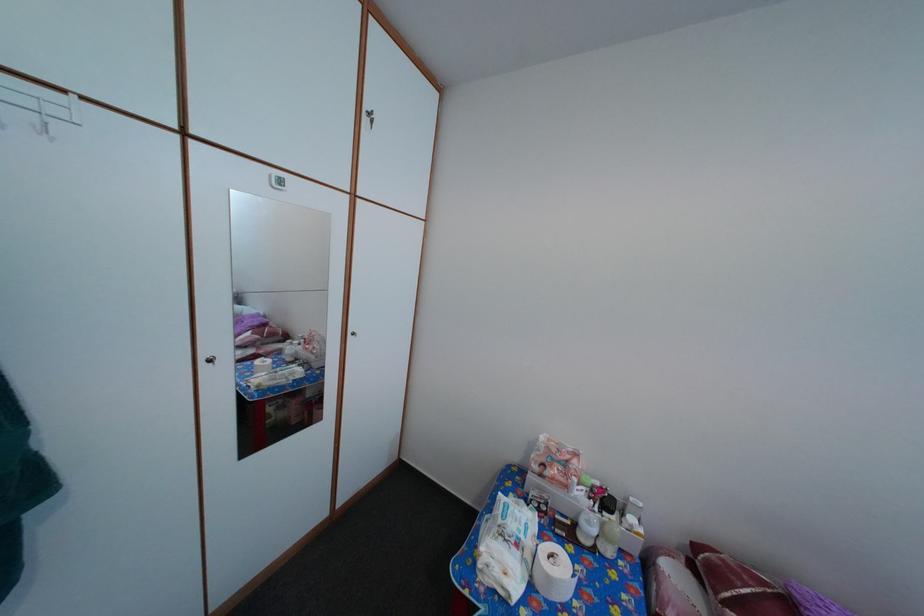
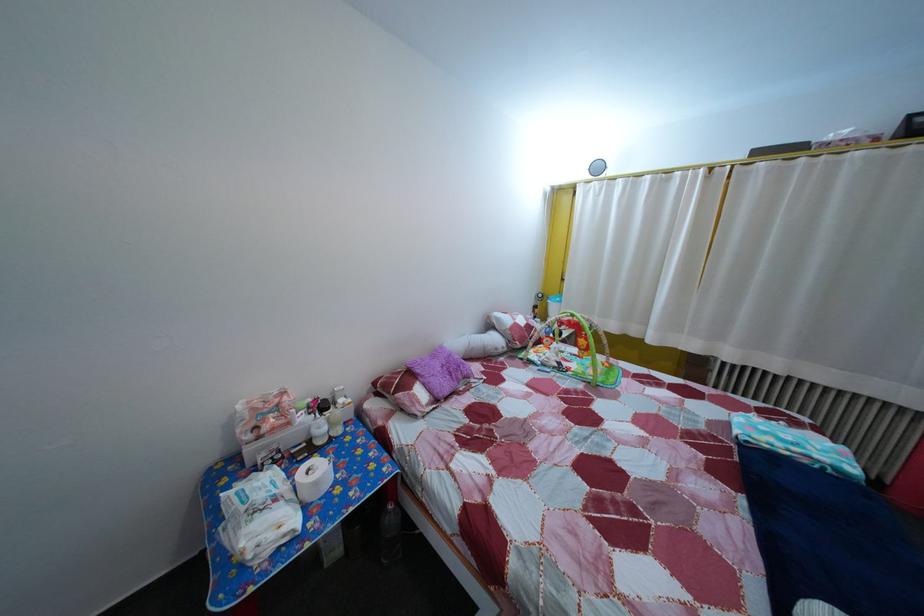
In the second image, find the point that corresponds to [558,586] in the first image.

(325, 491)